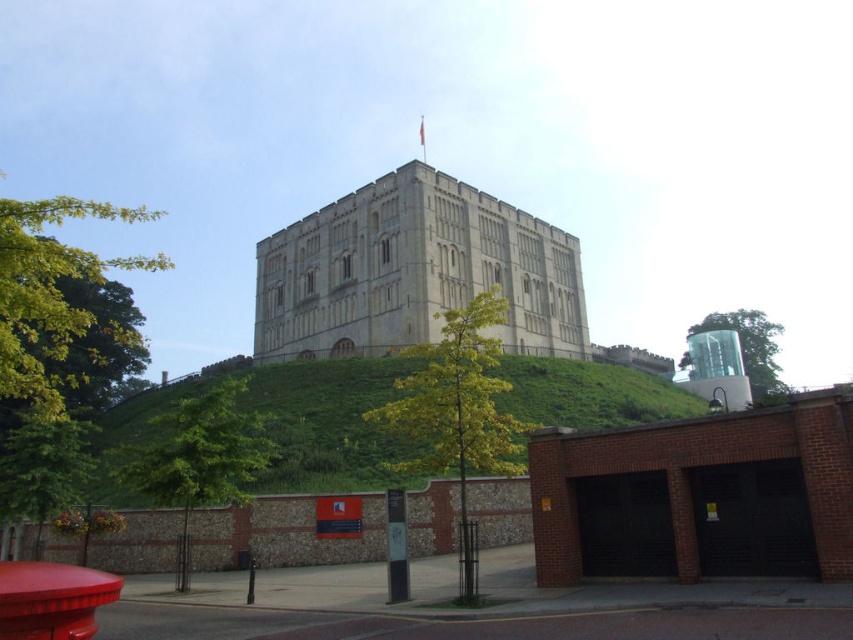
Question: Where is green leafy tree at left located in relation to green leafy tree at lower left in the image?

Choices:
 (A) left
 (B) right

Answer: (A)

Question: Estimate the real-world distances between objects in this image. Which object is farther from the transparent glass tree at upper right?

Choices:
 (A) green grassy hillside at upper center
 (B) beige stone castle at center

Answer: (A)

Question: Can you confirm if green leafy tree at lower left is positioned above transparent glass tree at upper right?

Choices:
 (A) yes
 (B) no

Answer: (B)

Question: Which of these objects is positioned closest to the green leafy tree at lower left?

Choices:
 (A) green leafy tree at center
 (B) beige stone castle at center
 (C) green grassy hillside at upper center

Answer: (C)

Question: Where is green leafy tree at center located in relation to green leafy tree at lower left in the image?

Choices:
 (A) left
 (B) right

Answer: (B)

Question: Which point appears closest to the camera in this image?

Choices:
 (A) (328, 333)
 (B) (459, 564)

Answer: (B)